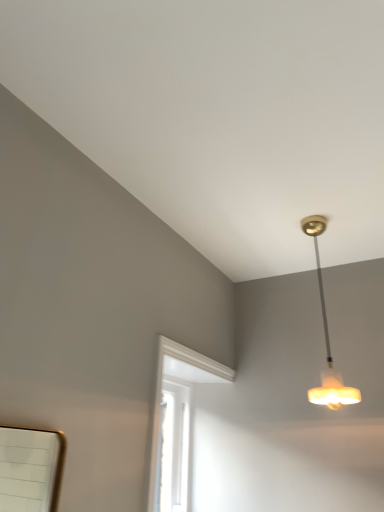
In order to click on white painted wood window at center in this screenshot , I will do `click(177, 423)`.

What do you see at coordinates (177, 423) in the screenshot? I see `white painted wood window at center` at bounding box center [177, 423].

Measure the distance between translucent glass pendant light at upper right and camera.

translucent glass pendant light at upper right and camera are 1.94 meters apart from each other.

At what (x,y) coordinates should I click in order to perform the action: click on translucent glass pendant light at upper right. Please return your answer as a coordinate pair (x, y). The width and height of the screenshot is (384, 512). Looking at the image, I should click on (327, 337).

This screenshot has width=384, height=512. What do you see at coordinates (327, 337) in the screenshot? I see `translucent glass pendant light at upper right` at bounding box center [327, 337].

Where is `white painted wood window at center`? Image resolution: width=384 pixels, height=512 pixels. white painted wood window at center is located at coordinates (177, 423).

Between translucent glass pendant light at upper right and white painted wood window at center, which one appears on the left side from the viewer's perspective?

white painted wood window at center.

Which is behind, translucent glass pendant light at upper right or white painted wood window at center?

translucent glass pendant light at upper right.

Does point (337, 390) come behind point (155, 479)?

No, (337, 390) is in front of (155, 479).

From the image's perspective, is translucent glass pendant light at upper right on white painted wood window at center?

Yes, from the image's perspective, translucent glass pendant light at upper right is on top of white painted wood window at center.

From a real-world perspective, does translucent glass pendant light at upper right sit lower than white painted wood window at center?

No, from a real-world perspective, translucent glass pendant light at upper right is not beneath white painted wood window at center.

Which of these two, translucent glass pendant light at upper right or white painted wood window at center, is thinner?

white painted wood window at center.

Does translucent glass pendant light at upper right have a lesser height compared to white painted wood window at center?

No, translucent glass pendant light at upper right is not shorter than white painted wood window at center.

Which of these two, translucent glass pendant light at upper right or white painted wood window at center, is bigger?

With larger size is white painted wood window at center.

Is translucent glass pendant light at upper right inside or outside of white painted wood window at center?

translucent glass pendant light at upper right exists outside the volume of white painted wood window at center.

Is translucent glass pendant light at upper right positioned far away from white painted wood window at center?

No, there isn't a large distance between translucent glass pendant light at upper right and white painted wood window at center.

Is translucent glass pendant light at upper right positioned with its back to white painted wood window at center?

No, white painted wood window at center is not at the back of translucent glass pendant light at upper right.

Locate an element on the screen. lamp on the right side of white painted wood window at center is located at coordinates (327, 337).

Considering the positions of objects white painted wood window at center and translucent glass pendant light at upper right in the image provided, who is more to the left, white painted wood window at center or translucent glass pendant light at upper right?

Positioned to the left is white painted wood window at center.

Does white painted wood window at center come in front of translucent glass pendant light at upper right?

Yes, white painted wood window at center is in front of translucent glass pendant light at upper right.

Is point (182, 479) positioned in front of point (356, 396)?

No, it is not.

From the image's perspective, would you say white painted wood window at center is shown under translucent glass pendant light at upper right?

Yes.

From a real-world perspective, between white painted wood window at center and translucent glass pendant light at upper right, who is vertically lower?

white painted wood window at center is physically lower.

Which object is thinner, white painted wood window at center or translucent glass pendant light at upper right?

white painted wood window at center is thinner.

Between white painted wood window at center and translucent glass pendant light at upper right, which one has less height?

white painted wood window at center is shorter.

Considering the relative sizes of white painted wood window at center and translucent glass pendant light at upper right in the image provided, is white painted wood window at center bigger than translucent glass pendant light at upper right?

Yes, white painted wood window at center is bigger than translucent glass pendant light at upper right.

Consider the image. Which is correct: white painted wood window at center is inside translucent glass pendant light at upper right, or outside of it?

white painted wood window at center is not enclosed by translucent glass pendant light at upper right.

Is white painted wood window at center far away from translucent glass pendant light at upper right?

They are positioned close to each other.

Is translucent glass pendant light at upper right at the back of white painted wood window at center?

No, white painted wood window at center is not facing the opposite direction of translucent glass pendant light at upper right.

Can you tell me how much white painted wood window at center and translucent glass pendant light at upper right differ in facing direction?

The angle between the facing direction of white painted wood window at center and the facing direction of translucent glass pendant light at upper right is 90.2 degrees.

How far apart are white painted wood window at center and translucent glass pendant light at upper right?

33.77 inches.

Identify the location of lamp above the white painted wood window at center (from the image's perspective). The image size is (384, 512). (327, 337).

Find the location of `lamp above the white painted wood window at center (from a real-world perspective)`. lamp above the white painted wood window at center (from a real-world perspective) is located at coordinates [x=327, y=337].

Identify the location of window below the translucent glass pendant light at upper right (from a real-world perspective). The image size is (384, 512). (177, 423).